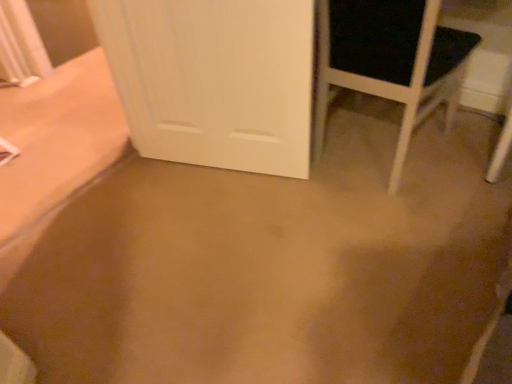
Question: Does point (223, 148) appear closer or farther from the camera than point (403, 150)?

Choices:
 (A) farther
 (B) closer

Answer: (A)

Question: From a real-world perspective, relative to black matte chair at right, is white wood door at center vertically above or below?

Choices:
 (A) above
 (B) below

Answer: (A)

Question: In the image, is white wood door at center positioned in front of or behind black matte chair at right?

Choices:
 (A) front
 (B) behind

Answer: (B)

Question: Is black matte chair at right in front of or behind white wood door at center in the image?

Choices:
 (A) behind
 (B) front

Answer: (B)

Question: Looking at their shapes, would you say black matte chair at right is wider or thinner than white wood door at center?

Choices:
 (A) wide
 (B) thin

Answer: (A)

Question: Considering the positions of point (391, 185) and point (165, 59), is point (391, 185) closer or farther from the camera than point (165, 59)?

Choices:
 (A) farther
 (B) closer

Answer: (A)

Question: In terms of height, does black matte chair at right look taller or shorter compared to white wood door at center?

Choices:
 (A) short
 (B) tall

Answer: (A)